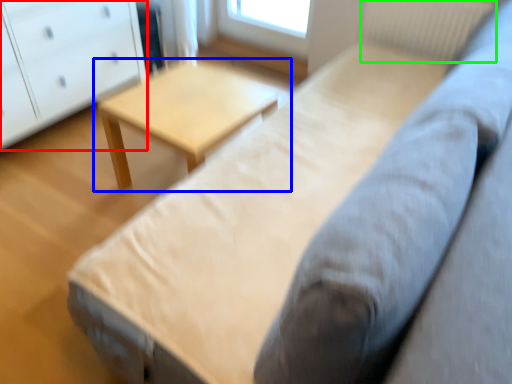
Question: Estimate the real-world distances between objects in this image. Which object is closer to chest of drawers (highlighted by a red box), table (highlighted by a blue box) or radiator (highlighted by a green box)?

Choices:
 (A) table
 (B) radiator

Answer: (A)